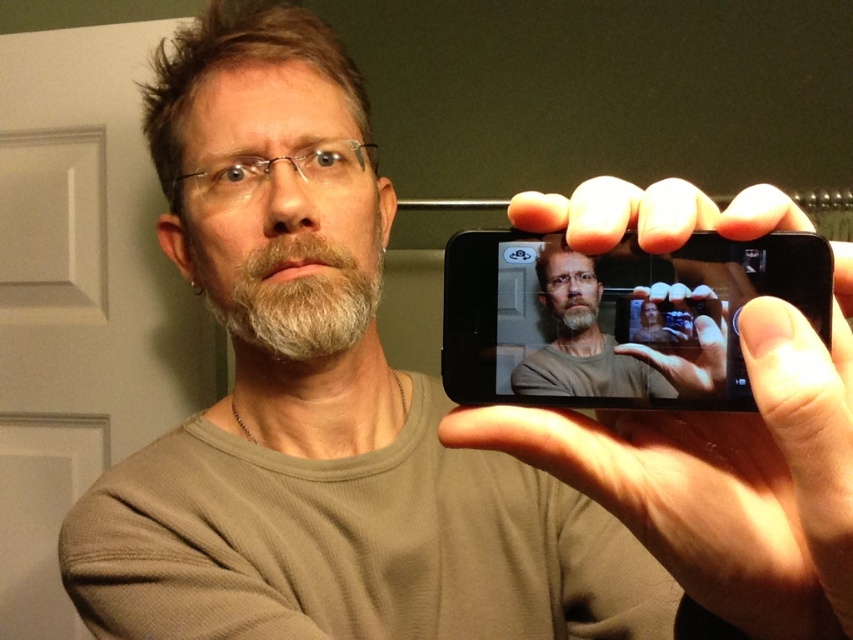
You are a photographer trying to capture a self portrait using the matte black phone at center. You notice the smooth skin hand at upper right is blocking part of the frame. Can the phone be positioned so that the hand doesn not cover the subject?

The smooth skin hand at upper right is wider than the matte black phone at center, so positioning the phone so the hand doesn not cover the subject may be challenging. The hand might still block part of the frame due to its greater width.

You are an interior designer analyzing the placement of furniture in the image. You need to determine if the smooth skin hand at upper right is located at the point specified by the coordinates. Is the point at coordinates [724,474] the location of the smooth skin hand at upper right?

Yes, the point at coordinates [724,474] corresponds to the smooth skin hand at upper right as described.

You are a photographer trying to capture a self portrait using the black matte smartphone at center. You notice the smooth skin hand at upper right appears too big in the reflection. What adjustment can you make to reduce the hand size in the photo?

To reduce the hand size in the photo, move the black matte smartphone at center further away from the smooth skin hand at upper right since the hand is currently larger than the smartphone, indicating it is closer to the camera.